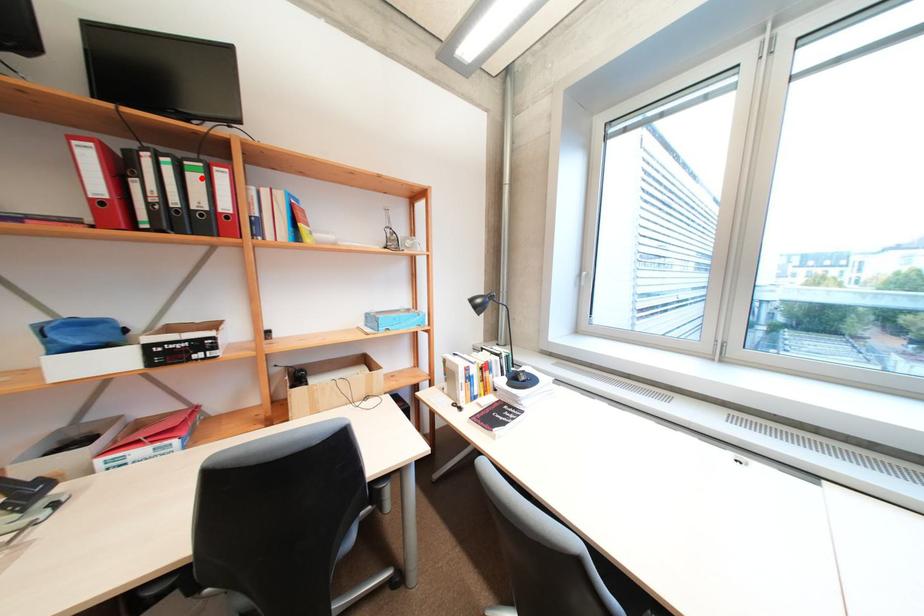
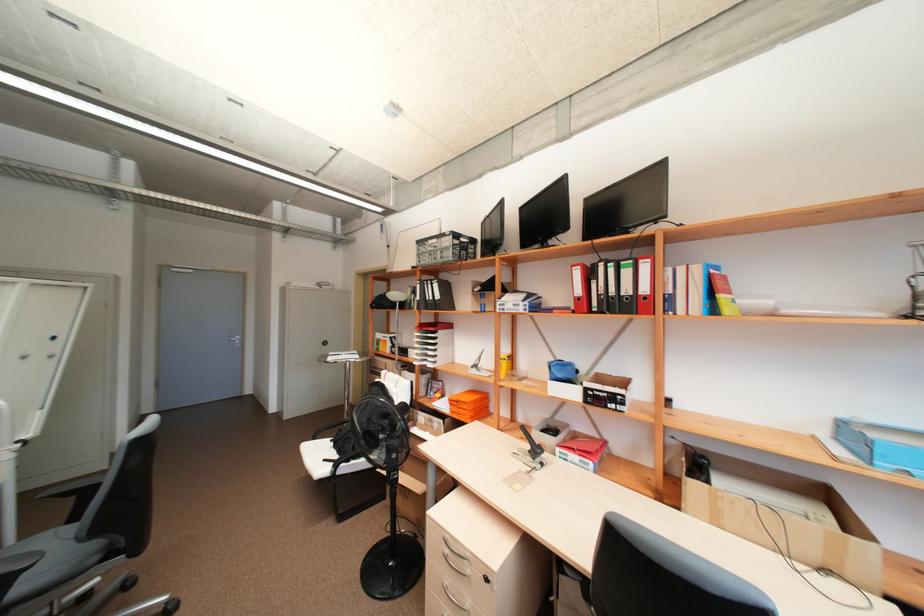
Where in the second image is the point corresponding to the highlighted location from the first image?

(633, 273)